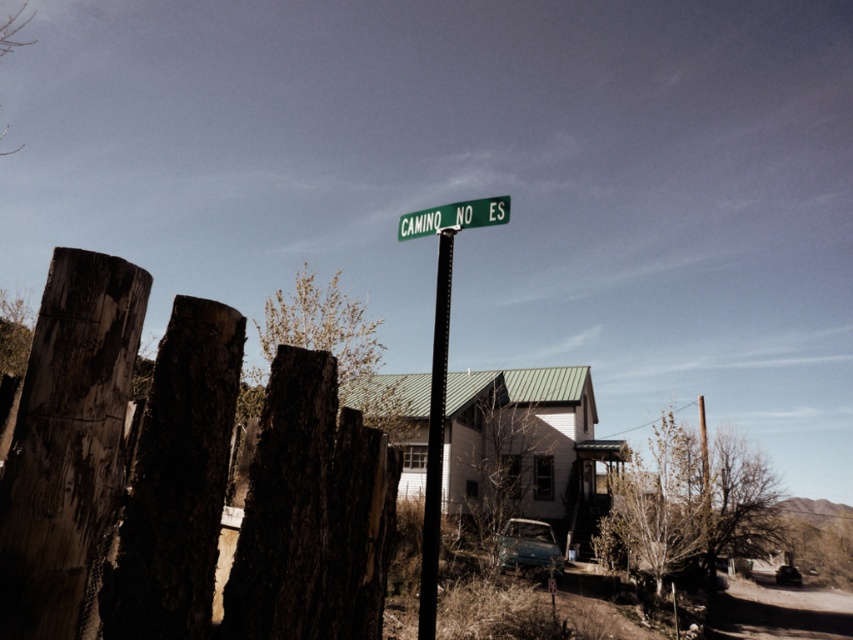
Question: Is teal matte car at center further to camera compared to metallic blue car at lower right?

Choices:
 (A) yes
 (B) no

Answer: (B)

Question: Can you confirm if green matte street sign at upper center is thinner than metallic blue car at lower right?

Choices:
 (A) no
 (B) yes

Answer: (B)

Question: Which point is closer to the camera taking this photo?

Choices:
 (A) (437, 554)
 (B) (790, 566)
 (C) (235, 561)
 (D) (479, 218)

Answer: (C)

Question: Is weathered wood fence at left thinner than metallic blue car at lower right?

Choices:
 (A) yes
 (B) no

Answer: (A)

Question: Which point is farther to the camera?

Choices:
 (A) weathered wood fence at left
 (B) teal matte car at center
 (C) green matte street sign at upper center
 (D) black metal pole at center

Answer: (B)

Question: Which point is farther to the camera?

Choices:
 (A) (560, 554)
 (B) (428, 432)
 (C) (782, 582)
 (D) (416, 224)

Answer: (C)